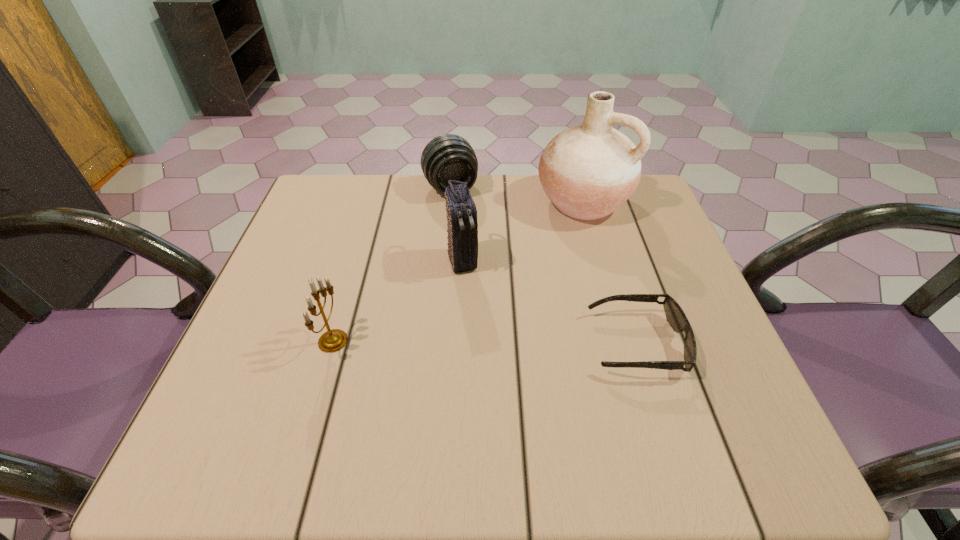
Where is `vacant space located to pour from the handle of the tallest object`? This screenshot has width=960, height=540. vacant space located to pour from the handle of the tallest object is located at coordinates (477, 320).

Identify the location of vacant space located 0.090m to pour from the handle of the tallest object. (544, 245).

Where is `blank area located 0.270m at the front element of the second shortest object`? Image resolution: width=960 pixels, height=540 pixels. blank area located 0.270m at the front element of the second shortest object is located at coordinates (489, 272).

Identify the location of vacant space located 0.230m at the front element of the second shortest object. (484, 260).

This screenshot has width=960, height=540. I want to click on free space located at the front element of the second shortest object, so click(x=509, y=314).

Find the location of a particular element. Image resolution: width=960 pixels, height=540 pixels. free space located 0.230m with the zip open on the third nearest object is located at coordinates (491, 364).

Find the location of a particular element. The height and width of the screenshot is (540, 960). free location located with the zip open on the third nearest object is located at coordinates (474, 308).

At what (x,y) coordinates should I click in order to perform the action: click on free point located with the zip open on the third nearest object. Please return your answer as a coordinate pair (x, y). The image size is (960, 540). Looking at the image, I should click on (496, 383).

The image size is (960, 540). Find the location of `pottery present at the far edge`. pottery present at the far edge is located at coordinates (588, 171).

You are a GUI agent. You are given a task and a screenshot of the screen. Output one action in this format:
    pyautogui.click(x=<x>, y=<y>)
    Task: Click on the telephoto lens situated at the far edge
    Image resolution: width=960 pixels, height=540 pixels.
    Given the screenshot: What is the action you would take?
    pyautogui.click(x=447, y=157)